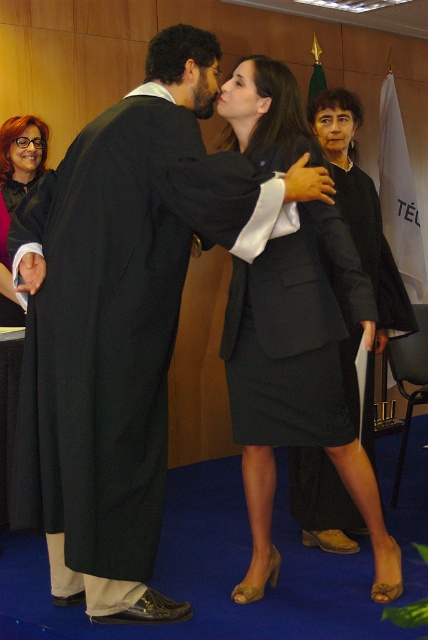
Who is positioned more to the left, black matte suit at center or matte black gown at left?

matte black gown at left is more to the left.

Is black matte suit at center above matte black gown at left?

Incorrect, black matte suit at center is not positioned above matte black gown at left.

Is point (318, 362) farther from camera compared to point (2, 253)?

No, (318, 362) is closer to viewer.

The image size is (428, 640). In order to click on black matte suit at center in this screenshot , I will do `click(294, 333)`.

Between point (335, 321) and point (14, 120), which one is positioned in front?

Point (335, 321)

In the scene shown: Does matte black suit at center have a greater height compared to matte black gown at left?

Yes.

Between point (372, 500) and point (8, 356), which one is positioned behind?

Point (8, 356)

Find the location of a particular element. This screenshot has width=428, height=640. matte black suit at center is located at coordinates (297, 380).

In the scene shown: Measure the distance from matte black suit at center to black matte suit at center.

They are 1.96 inches apart.

Who is more forward, [232,289] or [276,339]?

Positioned in front is point [276,339].

At what (x,y) coordinates should I click in order to perform the action: click on matte black suit at center. Please return your answer as a coordinate pair (x, y). Image resolution: width=428 pixels, height=640 pixels. Looking at the image, I should click on (297, 380).